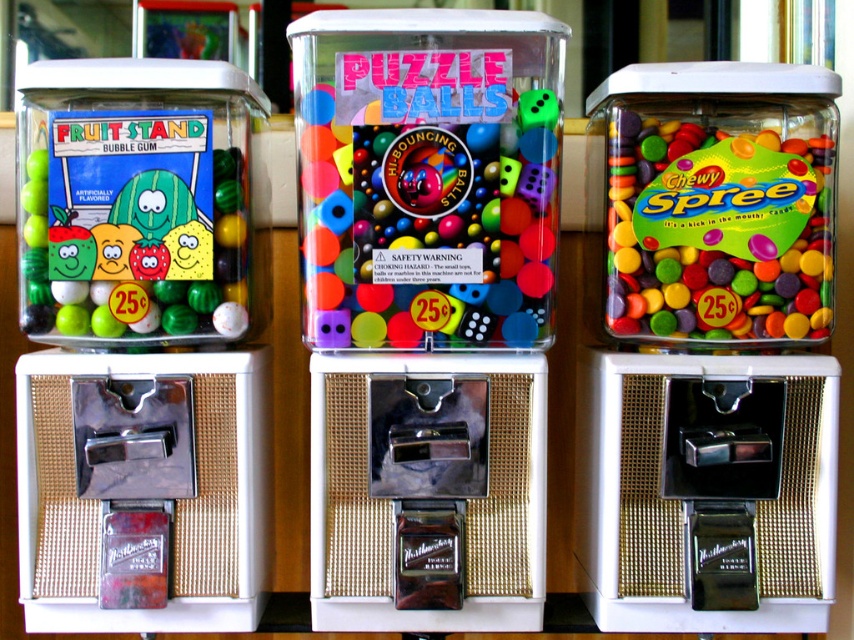
Locate an element on the screen. The image size is (854, 640). matte plastic jar at left is located at coordinates (133, 200).

Which of these two, matte plastic jar at left or multicolored plastic puzzle balls at center, stands taller?

With more height is matte plastic jar at left.

Where is `matte plastic jar at left`? This screenshot has height=640, width=854. matte plastic jar at left is located at coordinates (133, 200).

In the scene shown: Which of these two, matte plastic jar at left or matte plastic chewy spree at right, stands taller?

With more height is matte plastic jar at left.

Between point (102, 202) and point (630, 116), which one is positioned behind?

The point (630, 116) is more distant.

In order to click on matte plastic jar at left in this screenshot , I will do `click(133, 200)`.

Does multicolored plastic puzzle balls at center have a greater height compared to matte plastic chewy spree at right?

Correct, multicolored plastic puzzle balls at center is much taller as matte plastic chewy spree at right.

From the picture: Does multicolored plastic puzzle balls at center appear on the right side of matte plastic chewy spree at right?

Incorrect, multicolored plastic puzzle balls at center is not on the right side of matte plastic chewy spree at right.

Which is behind, point (319, 129) or point (747, 150)?

Positioned behind is point (747, 150).

The height and width of the screenshot is (640, 854). Find the location of `multicolored plastic puzzle balls at center`. multicolored plastic puzzle balls at center is located at coordinates (433, 228).